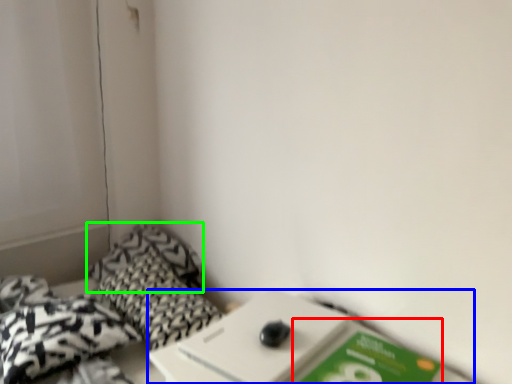
Question: Which is nearer to the paperback book (highlighted by a red box)? table (highlighted by a blue box) or pillow (highlighted by a green box).

Choices:
 (A) table
 (B) pillow

Answer: (A)